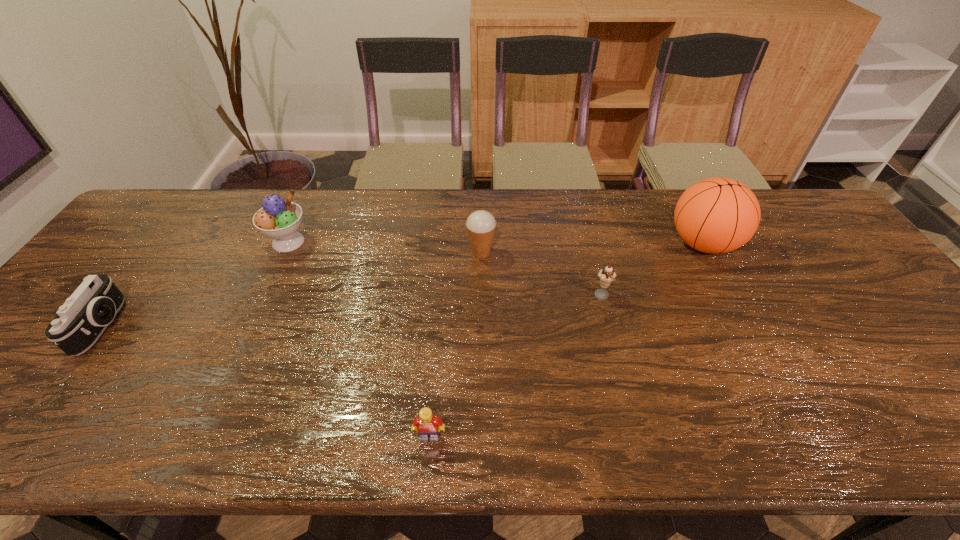
This screenshot has width=960, height=540. I want to click on basketball, so click(716, 215).

The image size is (960, 540). What are the coordinates of `the rightmost object` in the screenshot? It's located at (716, 215).

Identify the location of the fifth object from right to left. The width and height of the screenshot is (960, 540). (278, 218).

Identify the location of the second icecream from right to left. [x=481, y=225].

The width and height of the screenshot is (960, 540). What are the coordinates of `the shortest icecream` in the screenshot? It's located at (606, 276).

The height and width of the screenshot is (540, 960). What are the coordinates of `the nearest icecream` in the screenshot? It's located at (606, 276).

This screenshot has height=540, width=960. I want to click on the leftmost object, so click(x=80, y=321).

Identify the location of the fourth object from right to left. (427, 425).

You are a GUI agent. You are given a task and a screenshot of the screen. Output one action in this format:
    pyautogui.click(x=<x>, y=<y>)
    Task: Click on the nearest object
    This screenshot has width=960, height=540.
    Given the screenshot: What is the action you would take?
    pyautogui.click(x=427, y=425)

Find the location of `vacant space located on the right of the basketball`. vacant space located on the right of the basketball is located at coordinates (823, 244).